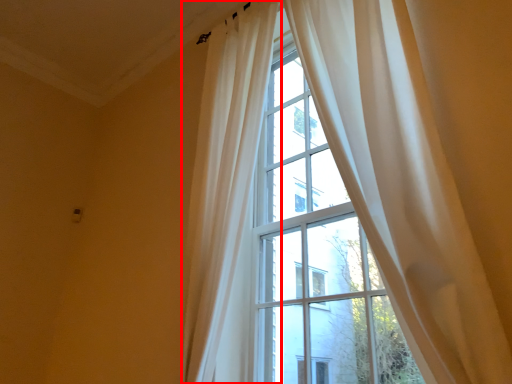
Question: In this image, where is curtain (annotated by the red box) located relative to curtain?

Choices:
 (A) right
 (B) left

Answer: (B)